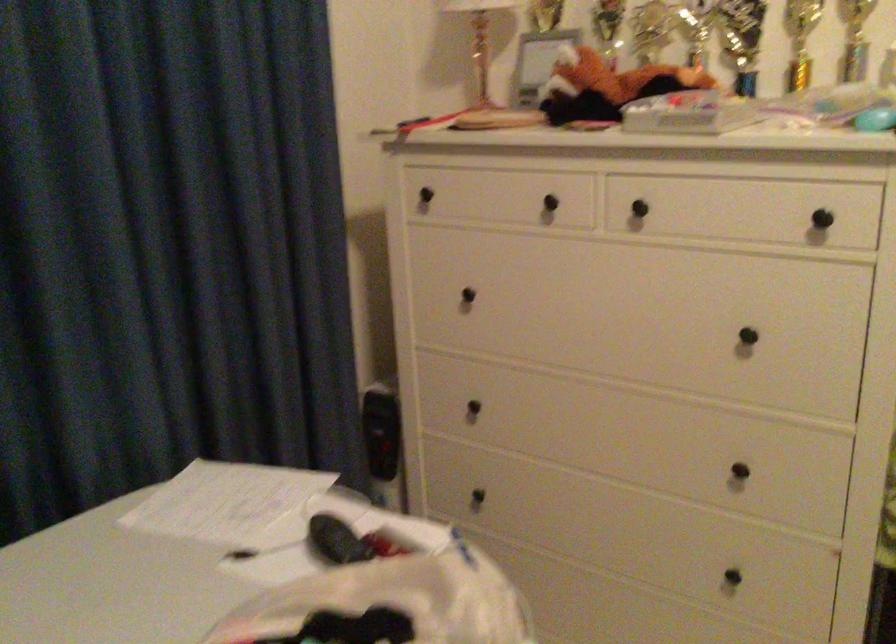
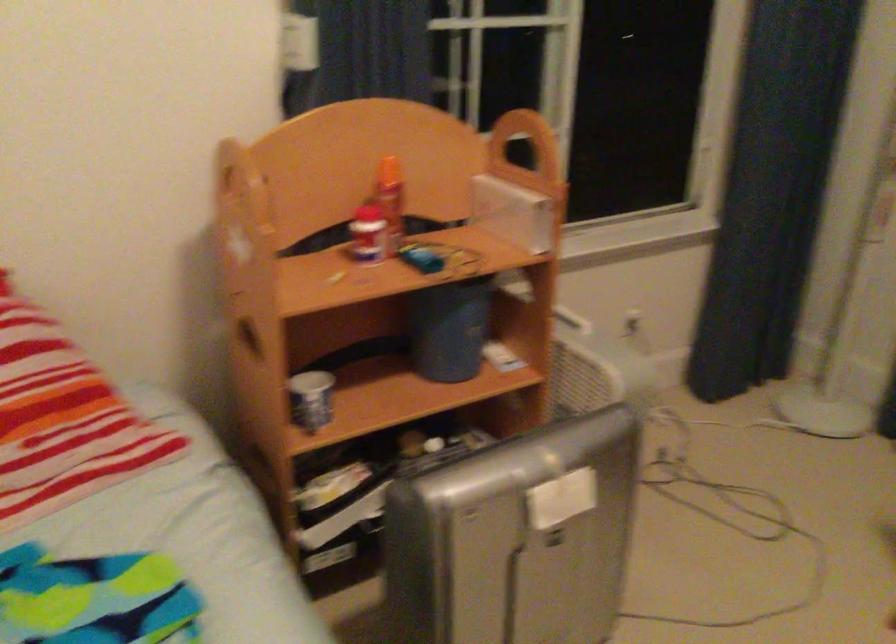
Based on the continuous images, in which direction is the camera rotating?

The camera's rotation is toward left-down.